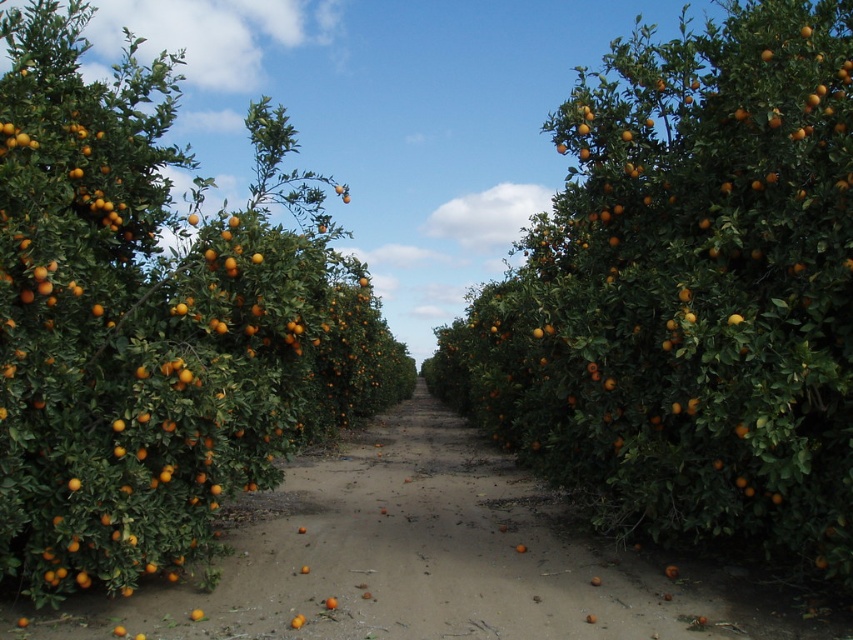
You are standing at the entrance of the citrus orchard and see two points marked in the image. Which point, point (231, 474) or point (476, 589), is closer to your current position?

Point (231, 474) is closer to the camera than point (476, 589), so it is closer to your current position.